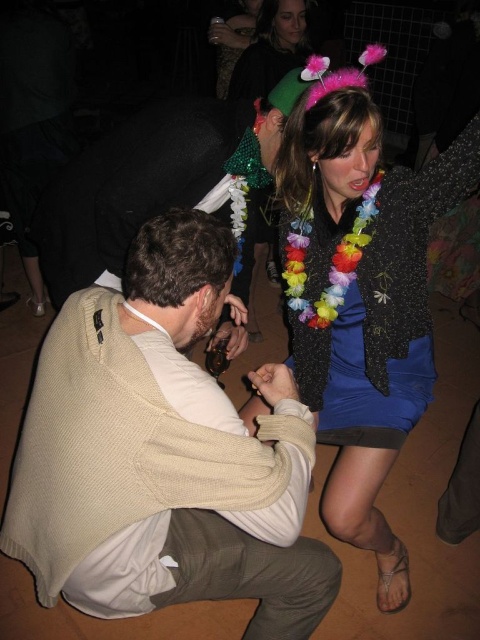
Question: Which is farther from the beige knitted sweater at center?

Choices:
 (A) beige sweater at lower left
 (B) multicolored flower lei at center
 (C) sparkly black jacket at upper right

Answer: (B)

Question: Can you confirm if sparkly black jacket at upper right is positioned to the left of beige sweater at lower left?

Choices:
 (A) no
 (B) yes

Answer: (A)

Question: Based on their relative distances, which object is nearer to the multicolored flower lei at center?

Choices:
 (A) beige sweater at lower left
 (B) sparkly black jacket at upper right
 (C) beige knitted sweater at center

Answer: (A)

Question: Based on their relative distances, which object is farther from the sparkly black jacket at upper right?

Choices:
 (A) beige sweater at lower left
 (B) multicolored flower lei at center

Answer: (B)

Question: Is beige sweater at lower left to the left of multicolored flower lei at center from the viewer's perspective?

Choices:
 (A) yes
 (B) no

Answer: (A)

Question: Is sparkly black jacket at upper right smaller than beige sweater at lower left?

Choices:
 (A) yes
 (B) no

Answer: (B)